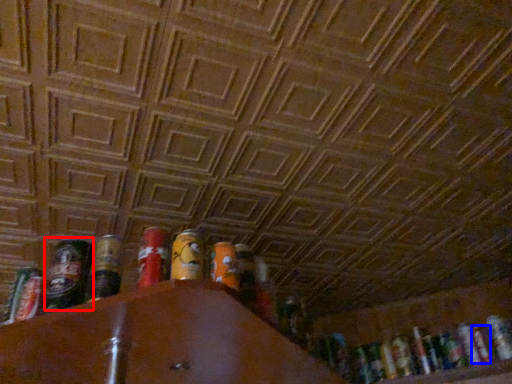
Question: Which of the following is the closest to the observer, beer (highlighted by a red box) or beer (highlighted by a blue box)?

Choices:
 (A) beer
 (B) beer

Answer: (A)